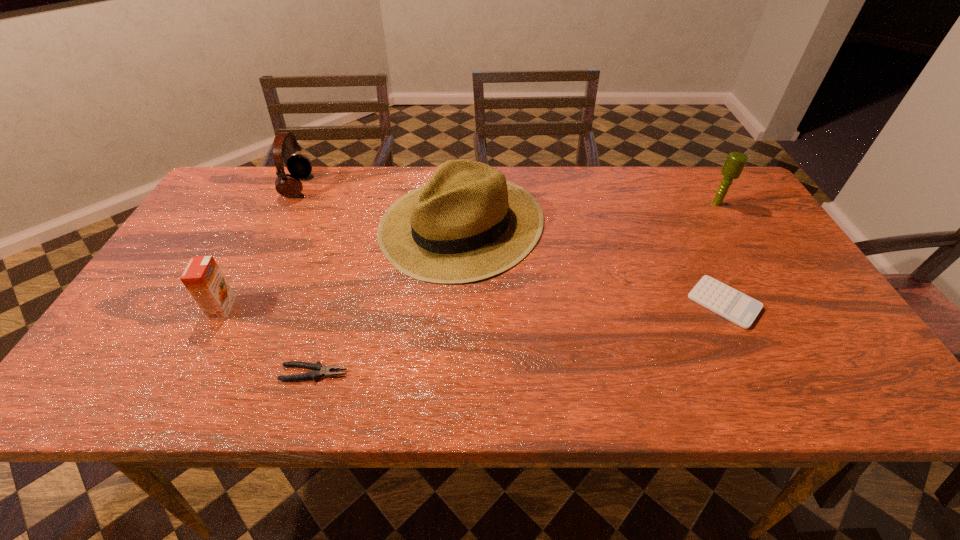
Find the location of `vacant region located 0.160m on the front of the rightmost object`. vacant region located 0.160m on the front of the rightmost object is located at coordinates (743, 246).

You are a GUI agent. You are given a task and a screenshot of the screen. Output one action in this format:
    pyautogui.click(x=<x>, y=<y>)
    Task: Click on the vacant space located on the right of the third shortest object
    The image size is (960, 540).
    Given the screenshot: What is the action you would take?
    pyautogui.click(x=276, y=308)

Find the location of a particular element. vacant space located at the gripping part of the pliers is located at coordinates (376, 373).

Where is `vacant area situated 0.110m on the front of the shortest object`? Image resolution: width=960 pixels, height=540 pixels. vacant area situated 0.110m on the front of the shortest object is located at coordinates pos(760,374).

I want to click on headset that is at the far edge, so click(x=299, y=166).

Where is `sunhat that is at the far edge`? This screenshot has height=540, width=960. sunhat that is at the far edge is located at coordinates (468, 223).

The height and width of the screenshot is (540, 960). I want to click on microphone located at the far edge, so click(735, 162).

Identify the location of object located in the near edge section of the desktop. The height and width of the screenshot is (540, 960). (318, 370).

Locate an element on the screen. microphone that is at the right edge is located at coordinates (735, 162).

Identify the location of calculator positioned at the right edge. This screenshot has width=960, height=540. (737, 307).